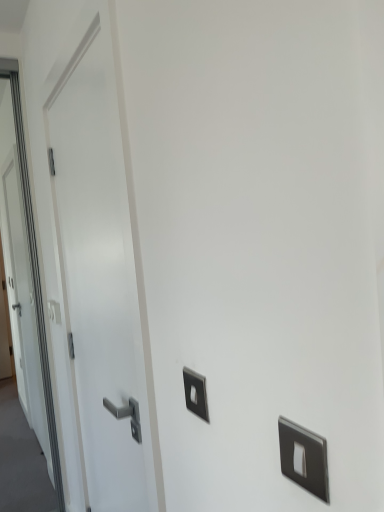
The width and height of the screenshot is (384, 512). What are the coordinates of `white glossy door at left` in the screenshot? It's located at (103, 273).

What is the approximate height of satin silver switch at center, the second light switch when ordered from left to right?

satin silver switch at center, the second light switch when ordered from left to right, is 3.79 inches tall.

At what (x,y) coordinates should I click in order to perform the action: click on satin silver switch at left, which appears as the first light switch when viewed from the back. Please return your answer as a coordinate pair (x, y). Looking at the image, I should click on (54, 311).

From the picture: Is satin silver switch at left, which appears as the first light switch when viewed from the back, taller or shorter than satin silver switch at center, the 2th light switch in the back-to-front sequence?

In the image, satin silver switch at left, which appears as the first light switch when viewed from the back, appears to be taller than satin silver switch at center, the 2th light switch in the back-to-front sequence.

Looking at the image, does satin silver switch at left, acting as the 2th light switch starting from the front, seem bigger or smaller compared to satin silver switch at center, the 2th light switch in the back-to-front sequence?

In the image, satin silver switch at left, acting as the 2th light switch starting from the front, appears to be larger than satin silver switch at center, the 2th light switch in the back-to-front sequence.

Is satin silver switch at left, acting as the 2th light switch starting from the front, at the left side of satin silver switch at center, the 2th light switch in the back-to-front sequence?

Result: Yes.

The image size is (384, 512). I want to click on light switch above the satin silver switch at left, acting as the first light switch starting from the left (from a real-world perspective), so click(x=195, y=393).

Is satin silver switch at center, marked as the first light switch in a front-to-back arrangement, facing towards satin silver switch at left, positioned as the 2th light switch in right-to-left order?

No, satin silver switch at center, marked as the first light switch in a front-to-back arrangement, is not turned towards satin silver switch at left, positioned as the 2th light switch in right-to-left order.

How different are the orientations of satin silver switch at center, which appears as the first light switch when viewed from the right, and satin silver switch at left, acting as the 2th light switch starting from the front, in degrees?

There is a 0.0296-degree angle between the facing directions of satin silver switch at center, which appears as the first light switch when viewed from the right, and satin silver switch at left, acting as the 2th light switch starting from the front.

Is satin silver switch at center, the 2th light switch in the back-to-front sequence, inside or outside of satin silver switch at left, positioned as the 2th light switch in right-to-left order?

satin silver switch at center, the 2th light switch in the back-to-front sequence, is spatially situated outside satin silver switch at left, positioned as the 2th light switch in right-to-left order.

Based on the photo, is satin silver switch at center, which appears as the first light switch when viewed from the right, to the right of satin silver switch at left, acting as the first light switch starting from the left, from the viewer's perspective?

Indeed, satin silver switch at center, which appears as the first light switch when viewed from the right, is positioned on the right side of satin silver switch at left, acting as the first light switch starting from the left.

Is white glossy door at left positioned beyond the bounds of satin silver switch at left, positioned as the 2th light switch in right-to-left order?

Yes.

From a real-world perspective, is white glossy door at left above or below satin silver switch at left, positioned as the 2th light switch in right-to-left order?

white glossy door at left is above satin silver switch at left, positioned as the 2th light switch in right-to-left order.

Between white glossy door at left and satin silver switch at left, acting as the 2th light switch starting from the front, which one has less height?

With less height is satin silver switch at left, acting as the 2th light switch starting from the front.

From their relative heights in the image, would you say white glossy door at left is taller or shorter than satin silver switch at center, which appears as the first light switch when viewed from the right?

white glossy door at left is taller than satin silver switch at center, which appears as the first light switch when viewed from the right.

Considering the points (109, 459) and (194, 405), which point is in front, point (109, 459) or point (194, 405)?

The point (194, 405) is closer.

Is white glossy door at left surrounding satin silver switch at center, the 2th light switch in the back-to-front sequence?

No, satin silver switch at center, the 2th light switch in the back-to-front sequence, is located outside of white glossy door at left.

Considering the points (194, 400) and (124, 261), which point is in front, point (194, 400) or point (124, 261)?

Positioned in front is point (194, 400).

From a real-world perspective, which object rests below the other?

satin silver switch at center, which appears as the first light switch when viewed from the right.

Looking at their sizes, would you say satin silver switch at center, the 2th light switch in the back-to-front sequence, is wider or thinner than white glossy door at left?

In the image, satin silver switch at center, the 2th light switch in the back-to-front sequence, appears to be more narrow than white glossy door at left.

Between satin silver switch at center, which appears as the first light switch when viewed from the right, and white glossy door at left, which one has more height?

white glossy door at left is taller.

Which of these two, satin silver switch at left, acting as the first light switch starting from the left, or white glossy door at left, stands shorter?

satin silver switch at left, acting as the first light switch starting from the left, is shorter.

Does satin silver switch at left, which appears as the first light switch when viewed from the back, appear on the left side of white glossy door at left?

Indeed, satin silver switch at left, which appears as the first light switch when viewed from the back, is positioned on the left side of white glossy door at left.

From a real-world perspective, is satin silver switch at left, which appears as the first light switch when viewed from the back, positioned above or below white glossy door at left?

From a real-world perspective, satin silver switch at left, which appears as the first light switch when viewed from the back, is physically below white glossy door at left.

From the image's perspective, is satin silver switch at left, which appears as the first light switch when viewed from the back, located above or below white glossy door at left?

From the image's perspective, satin silver switch at left, which appears as the first light switch when viewed from the back, appears below white glossy door at left.

In order to click on light switch below the satin silver switch at center, the 2th light switch in the back-to-front sequence (from a real-world perspective) in this screenshot , I will do [x=54, y=311].

Where is `light switch lying in front of the satin silver switch at left, acting as the first light switch starting from the left`? light switch lying in front of the satin silver switch at left, acting as the first light switch starting from the left is located at coordinates (195, 393).

Which object lies nearer to the anchor point white glossy door at left, satin silver switch at center, the second light switch when ordered from left to right, or satin silver switch at left, which appears as the first light switch when viewed from the back?

satin silver switch at center, the second light switch when ordered from left to right.

Based on their spatial positions, is satin silver switch at left, acting as the 2th light switch starting from the front, or white glossy door at left closer to satin silver switch at center, the second light switch when ordered from left to right?

Among the two, white glossy door at left is located nearer to satin silver switch at center, the second light switch when ordered from left to right.

Consider the image. Looking at the image, which one is located closer to satin silver switch at left, acting as the first light switch starting from the left, satin silver switch at center, marked as the first light switch in a front-to-back arrangement, or white glossy door at left?

white glossy door at left is closer to satin silver switch at left, acting as the first light switch starting from the left.

Considering their positions, is white glossy door at left positioned closer to satin silver switch at left, acting as the first light switch starting from the left, than satin silver switch at center, which appears as the first light switch when viewed from the right?

white glossy door at left.

From the image, which object appears to be farther from white glossy door at left, satin silver switch at left, acting as the first light switch starting from the left, or satin silver switch at center, marked as the first light switch in a front-to-back arrangement?

satin silver switch at left, acting as the first light switch starting from the left, lies further to white glossy door at left than the other object.

From the image, which object appears to be farther from satin silver switch at center, marked as the first light switch in a front-to-back arrangement, white glossy door at left or satin silver switch at left, acting as the 2th light switch starting from the front?

satin silver switch at left, acting as the 2th light switch starting from the front, lies further to satin silver switch at center, marked as the first light switch in a front-to-back arrangement, than the other object.

Find the location of a particular element. This screenshot has height=512, width=384. door between satin silver switch at center, the second light switch when ordered from left to right, and satin silver switch at left, positioned as the 2th light switch in right-to-left order, from front to back is located at coordinates (103, 273).